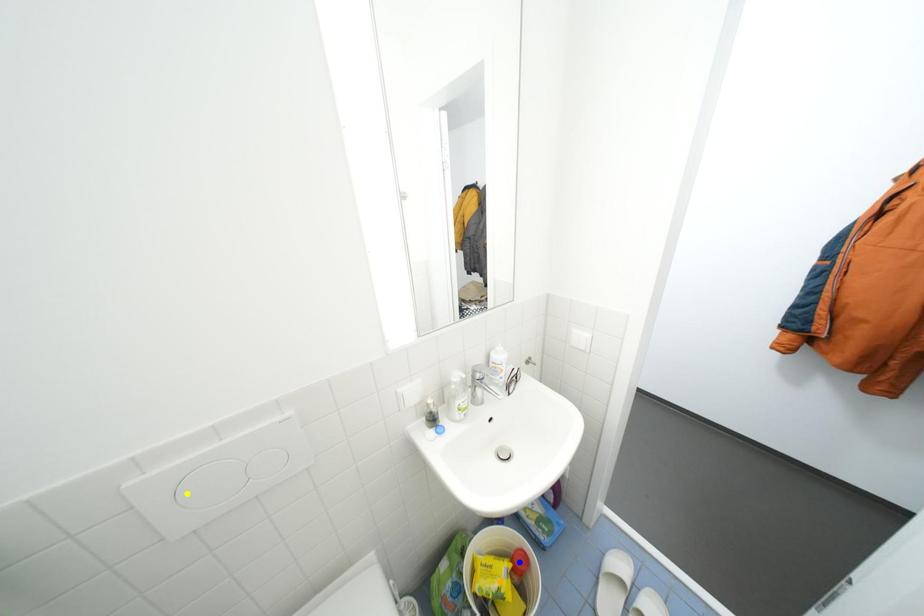
Order these from nearest to farthest:
yellow point
blue point
orange point

1. blue point
2. orange point
3. yellow point